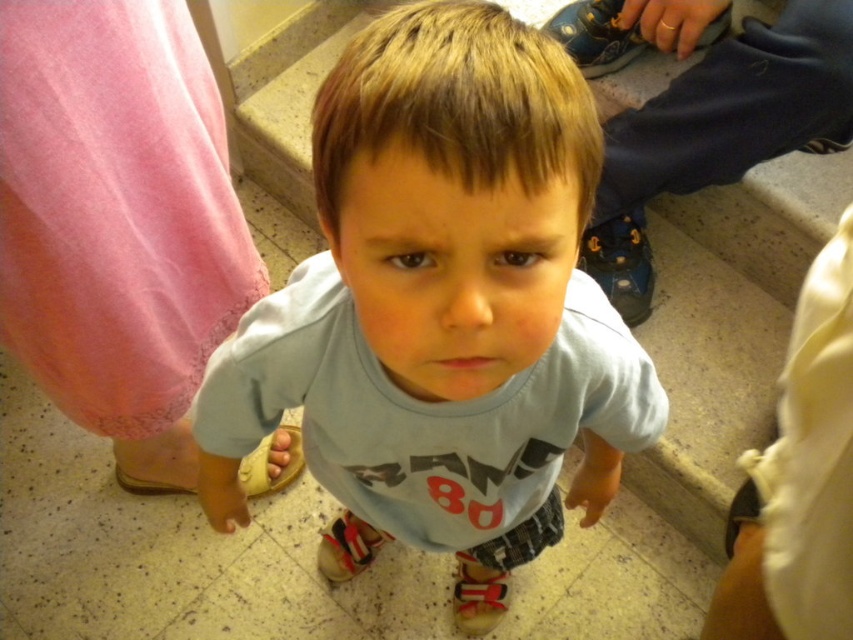
Question: Can you confirm if light blue t-shirt at center is positioned above tan suede sandal at lower center?

Choices:
 (A) no
 (B) yes

Answer: (B)

Question: Which object is closer to the camera taking this photo?

Choices:
 (A) light blue t-shirt at center
 (B) tan suede sandal at lower center

Answer: (A)

Question: Which point is farther to the camera?

Choices:
 (A) (258, 451)
 (B) (532, 193)

Answer: (A)

Question: Does light blue t-shirt at center have a smaller size compared to tan suede sandal at lower center?

Choices:
 (A) yes
 (B) no

Answer: (B)

Question: Which object appears farthest from the camera in this image?

Choices:
 (A) light blue t-shirt at center
 (B) tan suede sandal at lower center

Answer: (B)

Question: Where is light blue t-shirt at center located in relation to tan suede sandal at lower center in the image?

Choices:
 (A) below
 (B) above

Answer: (B)